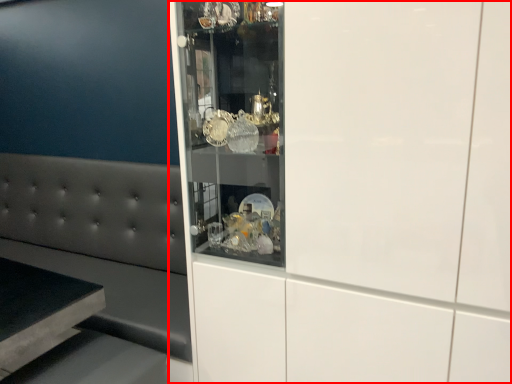
Question: From the image's perspective, where is cabinetry (annotated by the red box) located relative to furniture?

Choices:
 (A) above
 (B) below

Answer: (A)